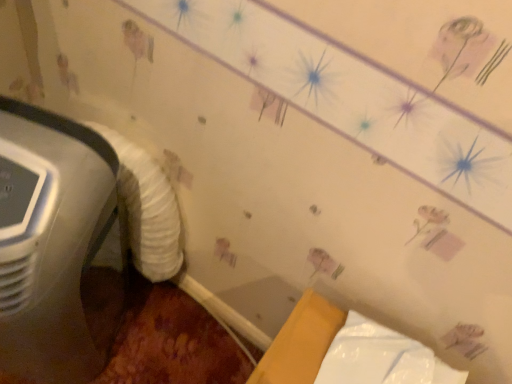
What is the approximate width of white plastic air conditioner at left?

white plastic air conditioner at left is 16.63 inches wide.

Image resolution: width=512 pixels, height=384 pixels. In order to click on white glossy wrapping paper at lower right in this screenshot , I will do `click(381, 358)`.

What do you see at coordinates (147, 209) in the screenshot? The height and width of the screenshot is (384, 512). I see `white fluffy sheet at left` at bounding box center [147, 209].

You are a GUI agent. You are given a task and a screenshot of the screen. Output one action in this format:
    pyautogui.click(x=<x>, y=<y>)
    Task: Click on the white plastic air conditioner at left
    The image size is (512, 384).
    Given the screenshot: What is the action you would take?
    pyautogui.click(x=53, y=244)

Is white plastic air conditioner at left looking in the opposite direction of white fluffy sheet at left?

Absolutely, white plastic air conditioner at left is directed away from white fluffy sheet at left.

Is white plastic air conditioner at left touching white fluffy sheet at left?

No, white plastic air conditioner at left is not next to white fluffy sheet at left.

Is white plastic air conditioner at left taller than white fluffy sheet at left?

Indeed, white plastic air conditioner at left has a greater height compared to white fluffy sheet at left.

Considering the relative sizes of white plastic air conditioner at left and white glossy wrapping paper at lower right in the image provided, is white plastic air conditioner at left smaller than white glossy wrapping paper at lower right?

No, white plastic air conditioner at left is not smaller than white glossy wrapping paper at lower right.

In the scene shown: Considering the relative sizes of white plastic air conditioner at left and white glossy wrapping paper at lower right in the image provided, is white plastic air conditioner at left shorter than white glossy wrapping paper at lower right?

No.

From the image's perspective, between white plastic air conditioner at left and white glossy wrapping paper at lower right, who is located below?

white glossy wrapping paper at lower right appears lower in the image.

Based on the photo, considering the sizes of objects white glossy wrapping paper at lower right and white plastic air conditioner at left in the image provided, who is taller, white glossy wrapping paper at lower right or white plastic air conditioner at left?

With more height is white plastic air conditioner at left.

Is white glossy wrapping paper at lower right located outside white plastic air conditioner at left?

Absolutely, white glossy wrapping paper at lower right is external to white plastic air conditioner at left.

Which is in front, point (445, 381) or point (19, 150)?

Positioned in front is point (19, 150).

Which of these two, white glossy wrapping paper at lower right or white plastic air conditioner at left, is thinner?

Thinner between the two is white glossy wrapping paper at lower right.

Looking at this image, is white fluffy sheet at left in contact with white plastic air conditioner at left?

No, white fluffy sheet at left is not touching white plastic air conditioner at left.

From a real-world perspective, is white fluffy sheet at left beneath white plastic air conditioner at left?

No, from a real-world perspective, white fluffy sheet at left is not below white plastic air conditioner at left.

Is white fluffy sheet at left to the right of white plastic air conditioner at left from the viewer's perspective?

Yes.

What's the angular difference between white fluffy sheet at left and white plastic air conditioner at left's facing directions?

They differ by 19.1 degrees in their facing directions.

Can you see white glossy wrapping paper at lower right touching white fluffy sheet at left?

No, white glossy wrapping paper at lower right is not with white fluffy sheet at left.

Is white glossy wrapping paper at lower right shorter than white fluffy sheet at left?

Yes, white glossy wrapping paper at lower right is shorter than white fluffy sheet at left.

From a real-world perspective, is white glossy wrapping paper at lower right physically located above or below white fluffy sheet at left?

In terms of real-world spatial position, white glossy wrapping paper at lower right is above white fluffy sheet at left.

Is white fluffy sheet at left looking in the opposite direction of white glossy wrapping paper at lower right?

No, white fluffy sheet at left is not facing the opposite direction of white glossy wrapping paper at lower right.

Based on their positions, is white fluffy sheet at left located to the left or right of white glossy wrapping paper at lower right?

Based on their positions, white fluffy sheet at left is located to the left of white glossy wrapping paper at lower right.

Consider the image. From a real-world perspective, is white fluffy sheet at left physically located above or below white glossy wrapping paper at lower right?

Clearly, from a real-world perspective, white fluffy sheet at left is below white glossy wrapping paper at lower right.

In terms of height, does white fluffy sheet at left look taller or shorter compared to white glossy wrapping paper at lower right?

In the image, white fluffy sheet at left appears to be taller than white glossy wrapping paper at lower right.

At what (x,y) coordinates should I click in order to perform the action: click on sheet lying behind the white plastic air conditioner at left. Please return your answer as a coordinate pair (x, y). This screenshot has width=512, height=384. Looking at the image, I should click on (147, 209).

The width and height of the screenshot is (512, 384). Identify the location of home appliance in front of the white glossy wrapping paper at lower right. (53, 244).

Looking at the image, which one is located closer to white plastic air conditioner at left, white glossy wrapping paper at lower right or white fluffy sheet at left?

white fluffy sheet at left lies closer to white plastic air conditioner at left than the other object.

Considering their positions, is white fluffy sheet at left positioned closer to white plastic air conditioner at left than white glossy wrapping paper at lower right?

Based on the image, white fluffy sheet at left appears to be nearer to white plastic air conditioner at left.

Looking at the image, which one is located closer to white fluffy sheet at left, white plastic air conditioner at left or white glossy wrapping paper at lower right?

Among the two, white plastic air conditioner at left is located nearer to white fluffy sheet at left.

Estimate the real-world distances between objects in this image. Which object is further from white fluffy sheet at left, white glossy wrapping paper at lower right or white plastic air conditioner at left?

The object further to white fluffy sheet at left is white glossy wrapping paper at lower right.

Considering their positions, is white fluffy sheet at left positioned closer to white glossy wrapping paper at lower right than white plastic air conditioner at left?

white fluffy sheet at left is closer to white glossy wrapping paper at lower right.

From the image, which object appears to be nearer to white glossy wrapping paper at lower right, white plastic air conditioner at left or white fluffy sheet at left?

white fluffy sheet at left lies closer to white glossy wrapping paper at lower right than the other object.

The image size is (512, 384). Identify the location of sheet between white plastic air conditioner at left and white glossy wrapping paper at lower right in the horizontal direction. (147, 209).